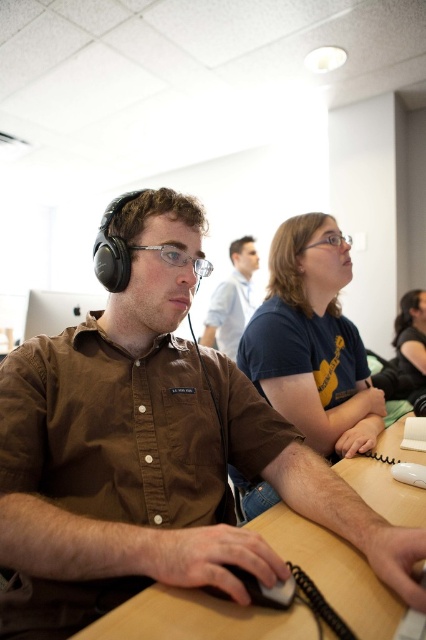
You are standing in the classroom and want to hand a document to the person wearing the matte brown shirt at center. To reach them, you need to pass by the black matte mouse at lower center. Is the path clear for you to approach the person without moving the mouse?

The matte brown shirt at center is further to the viewer than the black matte mouse at lower center, meaning the person is closer to you. Therefore, you can approach them without moving the mouse as the path is clear.

You are standing in the classroom and want to reach the point marked at coordinates point (140, 538). If you can extend your arm 24 inches, can you reach it without moving your feet?

The distance between you and point (140, 538) is 24.15 inches. Since your arm can only extend 24 inches, you cannot quite reach it without moving your feet.

You are standing in the classroom and see the wooden table at center and the matte brown shirt at center. Which object is located to the right of the other?

The wooden table at center is positioned on the right side of matte brown shirt at center.